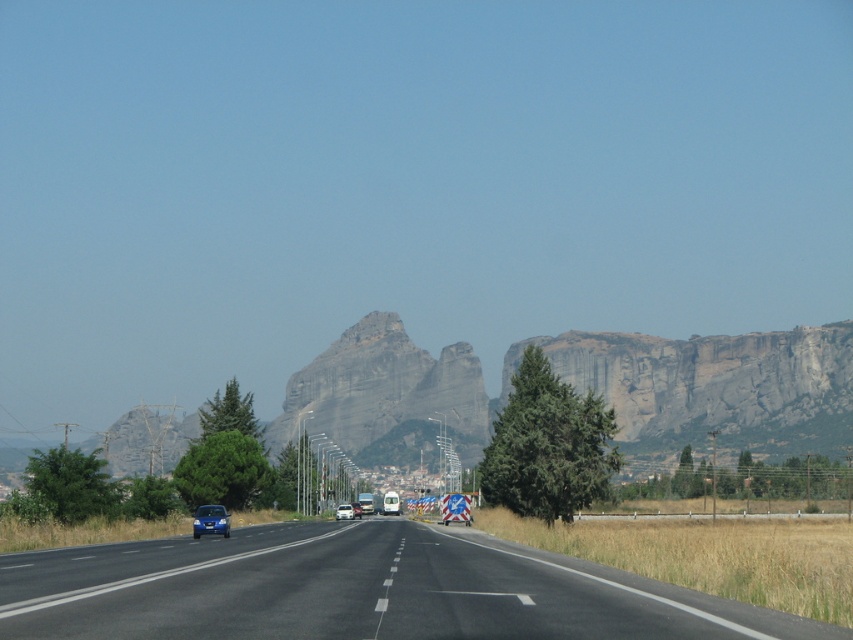
Looking at this image, you are a driver approaching the black asphalt highway at center and see the metallic blue car at lower left. Is the highway above or below the car?

The black asphalt highway at center is above the metallic blue car at lower left.

You are driving a truck that is 2.5 meters wide. You see the metallic blue car at lower left and the blue matte car at center on the road. Can your truck pass between them without touching either car?

The metallic blue car at lower left might be wider than blue matte car at center. Since the truck is 2.5 meters wide, it is uncertain if there is enough space between them to pass safely. Check the actual distance before proceeding.

You are a driver approaching the highway and see the metallic blue car at lower left and the blue matte car at center. Which car is closer to the left side of the road?

The metallic blue car at lower left is positioned on the left side of the blue matte car at center, so it is closer to the left side of the road.